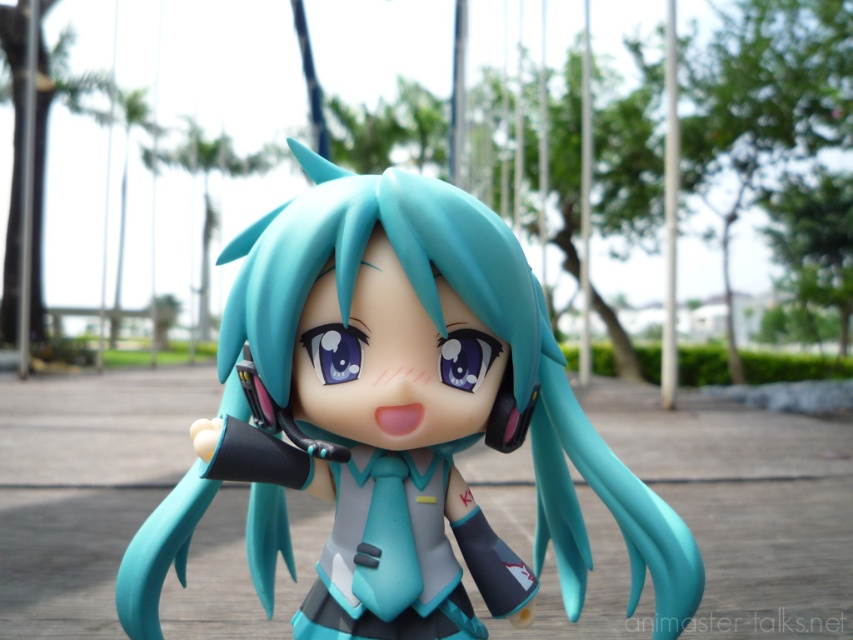
Does point (250, 547) come closer to viewer compared to point (402, 472)?

No.

You are a GUI agent. You are given a task and a screenshot of the screen. Output one action in this format:
    pyautogui.click(x=<x>, y=<y>)
    Task: Click on the matte plastic figure at center
    This screenshot has height=640, width=853.
    Given the screenshot: What is the action you would take?
    pyautogui.click(x=444, y=337)